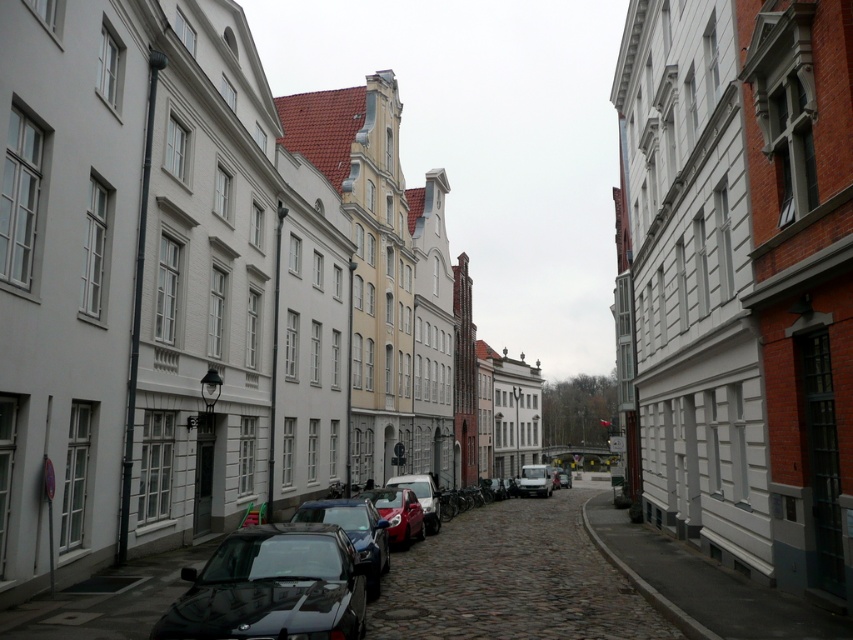
Question: Which point is farther to the camera?

Choices:
 (A) (438, 524)
 (B) (541, 480)
 (C) (412, 538)
 (D) (369, 502)

Answer: (B)

Question: Which of the following is the farthest from the observer?

Choices:
 (A) shiny black car at center
 (B) matte silver van at center
 (C) white smooth wall at lower right
 (D) shiny red car at center

Answer: (B)

Question: Which point is farther to the camera?

Choices:
 (A) (524, 490)
 (B) (368, 550)
 (C) (338, 612)

Answer: (A)

Question: Observing the image, what is the correct spatial positioning of shiny black car at center in reference to shiny red car at center?

Choices:
 (A) below
 (B) above

Answer: (A)

Question: Is white smooth wall at lower right thinner than shiny black car at center?

Choices:
 (A) yes
 (B) no

Answer: (B)

Question: Is white smooth wall at lower right above metallic silver car at center?

Choices:
 (A) yes
 (B) no

Answer: (A)